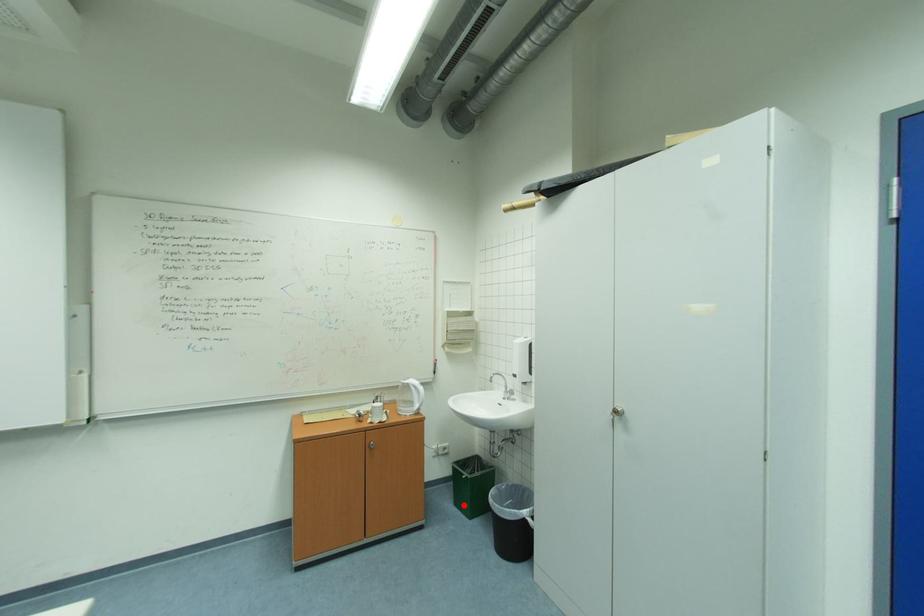
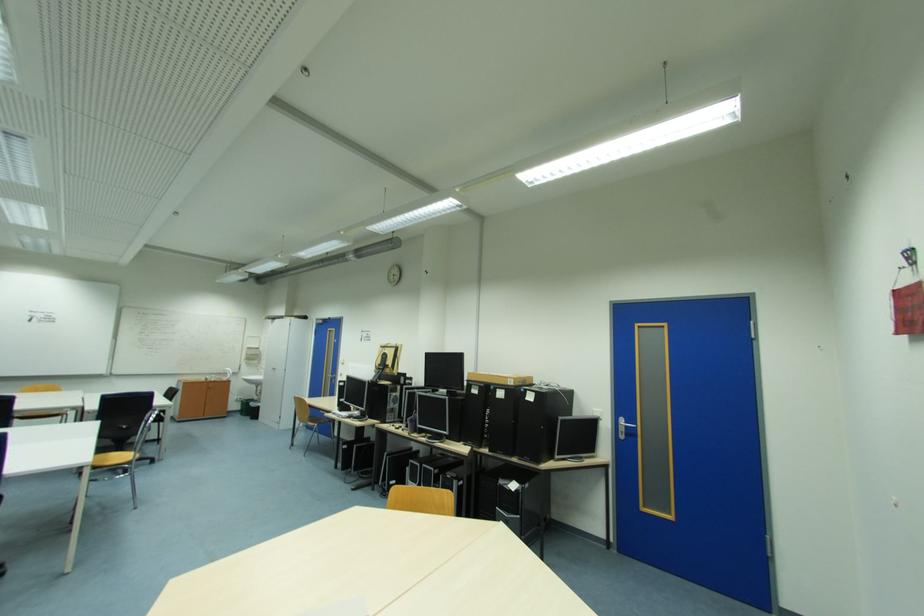
Locate, in the second image, the point that corresponds to the highlighted location in the first image.

(249, 416)